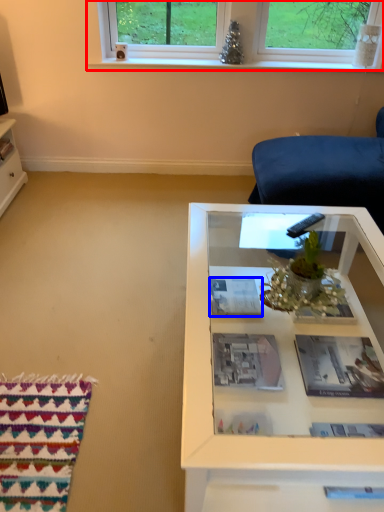
Question: Which of the following is the closest to the observer, window (highlighted by a red box) or magazine (highlighted by a blue box)?

Choices:
 (A) window
 (B) magazine

Answer: (B)